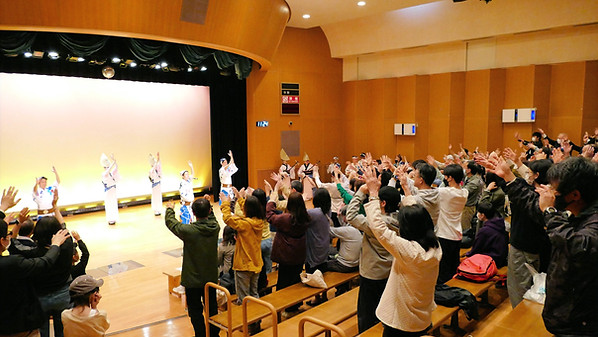
Find the location of a particular element. floor is located at coordinates (150, 329).